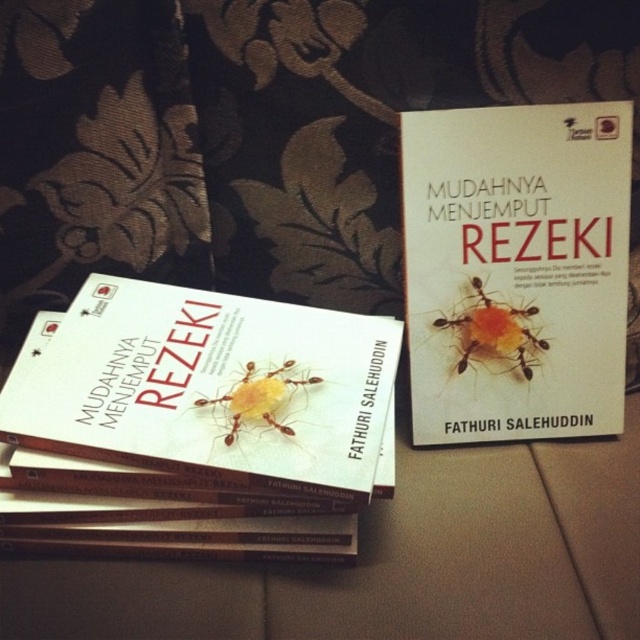
Does white matte book at center come in front of yellow matte ant at center?

Yes, white matte book at center is in front of yellow matte ant at center.

Identify the location of white matte book at center. The height and width of the screenshot is (640, 640). (209, 387).

Is point (292, 465) closer to camera compared to point (280, 428)?

Yes, point (292, 465) is in front of point (280, 428).

This screenshot has width=640, height=640. What are the coordinates of `white matte book at center` in the screenshot? It's located at click(209, 387).

Does yellow matte insect at center have a larger size compared to yellow matte ant at center?

No.

Does yellow matte insect at center have a greater width compared to yellow matte ant at center?

Yes.

What do you see at coordinates (492, 333) in the screenshot? I see `yellow matte insect at center` at bounding box center [492, 333].

Identify the location of yellow matte insect at center. (492, 333).

Is white matte book at center bigger than yellow matte insect at center?

Indeed, white matte book at center has a larger size compared to yellow matte insect at center.

Does point (241, 326) lie in front of point (480, 310)?

Yes, it is.

Measure the distance between point (314,529) and camera.

Point (314,529) is 33.18 inches away from camera.

Where is `white matte book at center`? white matte book at center is located at coordinates (209, 387).